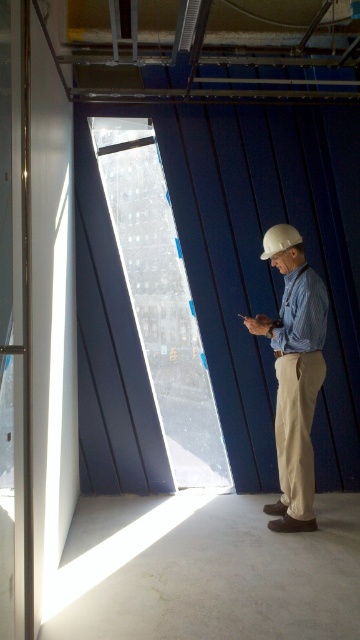
You are a safety inspector at this construction site. You need to ensure that the white matte helmet at center is visible from the entrance. Given that the striped cotton shirt at center is wider than the helmet, could the helmet still be visible behind the shirt?

The striped cotton shirt at center is wider than the white matte helmet at center, so if the shirt is positioned in front of the helmet, it might partially or fully obscure the helmet depending on their exact positions. However, since both are at the center, there is a possibility that parts of the helmet remain visible if not completely covered.

You are an inspector at the construction site. You notice the striped cotton shirt at center and the white matte helmet at center. Which object is closer to you based on their positions?

The striped cotton shirt at center is in front of the white matte helmet at center, so the striped cotton shirt at center is closer to you.

You are an inspector at the construction site. You notice the striped cotton shirt at center and the white matte helmet at center. Which object is taller?

The striped cotton shirt at center is taller than the white matte helmet at center.